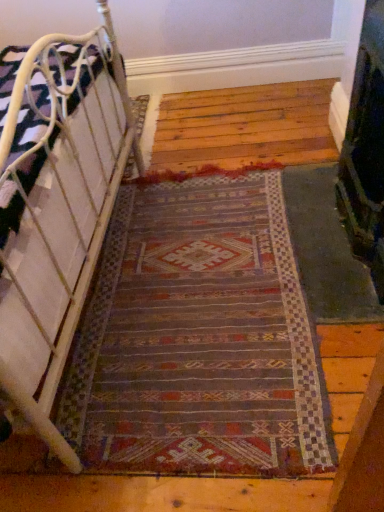
Question: Considering the relative sizes of white metal bed at left and multicolored woven rug at center in the image provided, is white metal bed at left taller than multicolored woven rug at center?

Choices:
 (A) yes
 (B) no

Answer: (A)

Question: Is white metal bed at left in contact with multicolored woven rug at center?

Choices:
 (A) no
 (B) yes

Answer: (A)

Question: Is white metal bed at left outside multicolored woven rug at center?

Choices:
 (A) yes
 (B) no

Answer: (A)

Question: Would you consider white metal bed at left to be distant from multicolored woven rug at center?

Choices:
 (A) yes
 (B) no

Answer: (B)

Question: Is white metal bed at left wider than multicolored woven rug at center?

Choices:
 (A) yes
 (B) no

Answer: (B)

Question: Is dark green textured fireplace at right inside the boundaries of white metal bed at left, or outside?

Choices:
 (A) outside
 (B) inside

Answer: (A)

Question: Considering the positions of dark green textured fireplace at right and white metal bed at left in the image, is dark green textured fireplace at right bigger or smaller than white metal bed at left?

Choices:
 (A) small
 (B) big

Answer: (A)

Question: Looking at their shapes, would you say dark green textured fireplace at right is wider or thinner than white metal bed at left?

Choices:
 (A) thin
 (B) wide

Answer: (A)

Question: In terms of height, does dark green textured fireplace at right look taller or shorter compared to white metal bed at left?

Choices:
 (A) tall
 (B) short

Answer: (A)

Question: From the image's perspective, is white metal bed at left positioned above or below multicolored woven rug at center?

Choices:
 (A) below
 (B) above

Answer: (B)

Question: Considering the positions of white metal bed at left and multicolored woven rug at center in the image, is white metal bed at left bigger or smaller than multicolored woven rug at center?

Choices:
 (A) big
 (B) small

Answer: (A)

Question: Considering the relative positions of white metal bed at left and multicolored woven rug at center in the image provided, is white metal bed at left to the left or to the right of multicolored woven rug at center?

Choices:
 (A) right
 (B) left

Answer: (B)

Question: Does point (61, 352) appear closer or farther from the camera than point (271, 252)?

Choices:
 (A) closer
 (B) farther

Answer: (A)

Question: Considering the positions of point (157, 231) and point (6, 382), is point (157, 231) closer or farther from the camera than point (6, 382)?

Choices:
 (A) closer
 (B) farther

Answer: (B)

Question: From their relative heights in the image, would you say multicolored woven rug at center is taller or shorter than white metal bed at left?

Choices:
 (A) short
 (B) tall

Answer: (A)